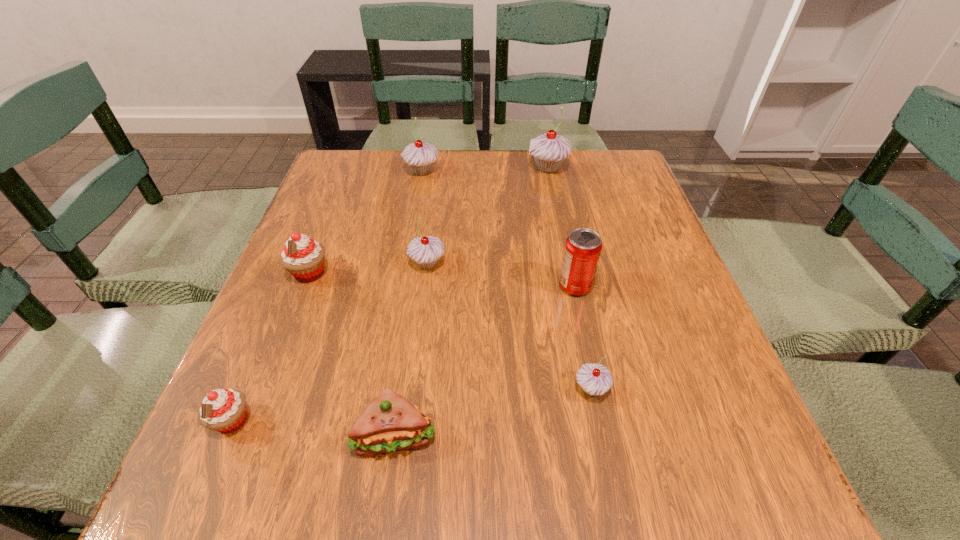
Locate an element on the screen. free space that satisfies the following two spatial constraints: 1. on the back side of the biggest gray cupcake; 2. on the right side of the nearer pink cupcake is located at coordinates (339, 168).